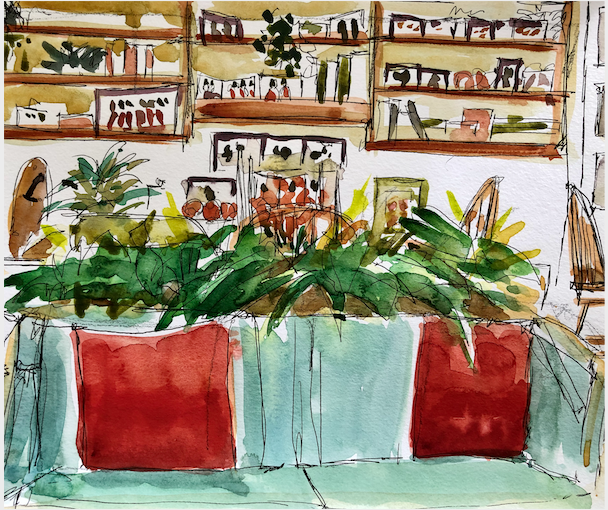
Where is `1 couch`? The width and height of the screenshot is (608, 510). 1 couch is located at coordinates (353, 464).